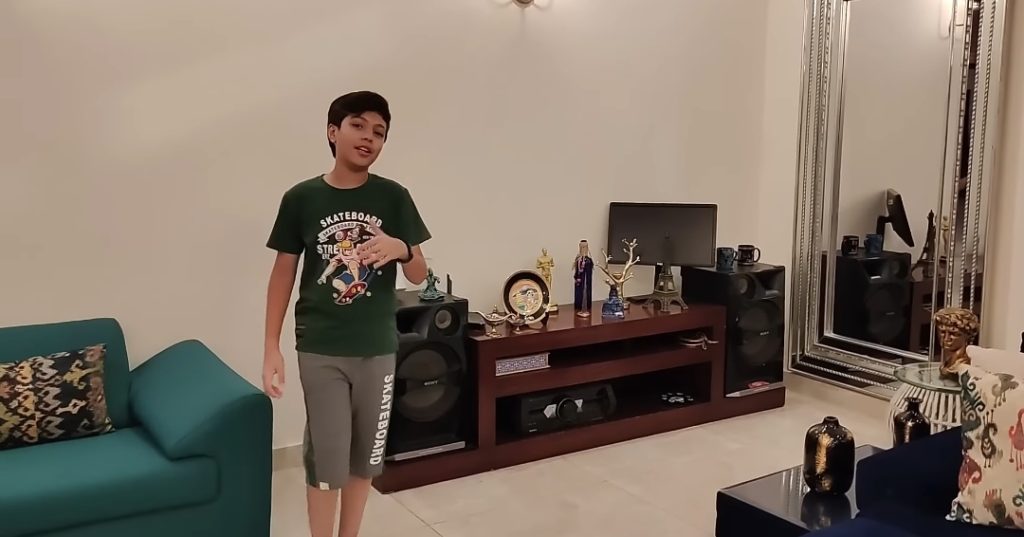
At what (x,y) coordinates should I click in order to perform the action: click on mirror. Please return your answer as a coordinate pair (x, y). The image size is (1024, 537). Looking at the image, I should click on (919, 243).